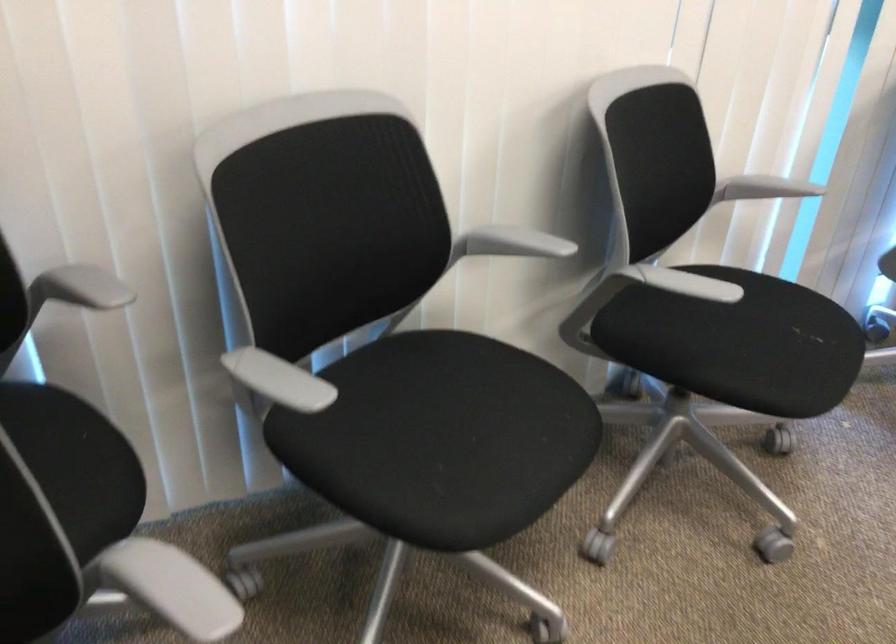
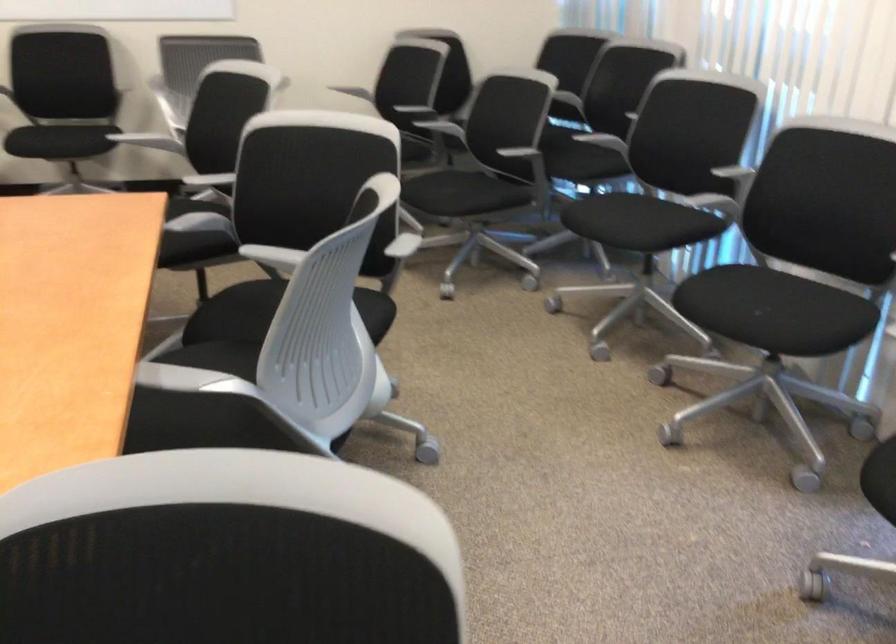
The point at (440, 287) is marked in the first image. Where is the corresponding point in the second image?

(726, 193)